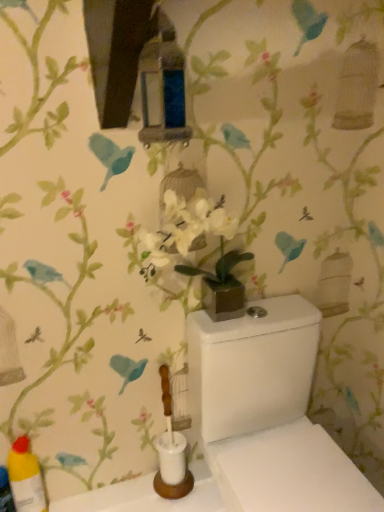
Question: Do you think yellow plastic bottle at lower left is within white glossy toilet at center, or outside of it?

Choices:
 (A) outside
 (B) inside

Answer: (A)

Question: In terms of width, does yellow plastic bottle at lower left look wider or thinner when compared to white glossy toilet at center?

Choices:
 (A) thin
 (B) wide

Answer: (A)

Question: From a real-world perspective, is yellow plastic bottle at lower left physically located above or below white glossy toilet at center?

Choices:
 (A) above
 (B) below

Answer: (B)

Question: Based on their sizes in the image, would you say white glossy toilet at center is bigger or smaller than yellow plastic bottle at lower left?

Choices:
 (A) small
 (B) big

Answer: (B)

Question: Is white glossy toilet at center wider or thinner than yellow plastic bottle at lower left?

Choices:
 (A) wide
 (B) thin

Answer: (A)

Question: From a real-world perspective, is white glossy toilet at center physically located above or below yellow plastic bottle at lower left?

Choices:
 (A) below
 (B) above

Answer: (B)

Question: From their relative heights in the image, would you say white glossy toilet at center is taller or shorter than yellow plastic bottle at lower left?

Choices:
 (A) short
 (B) tall

Answer: (B)